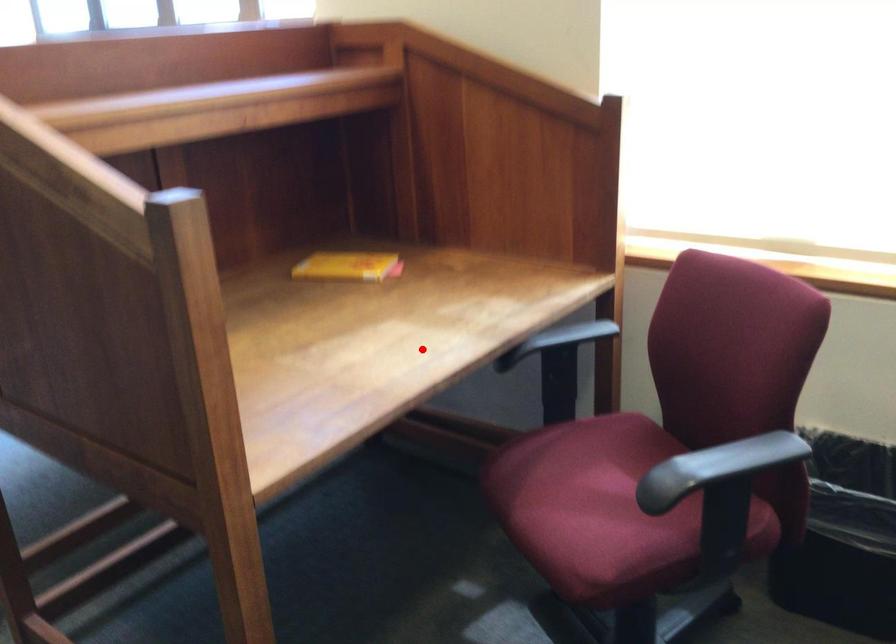
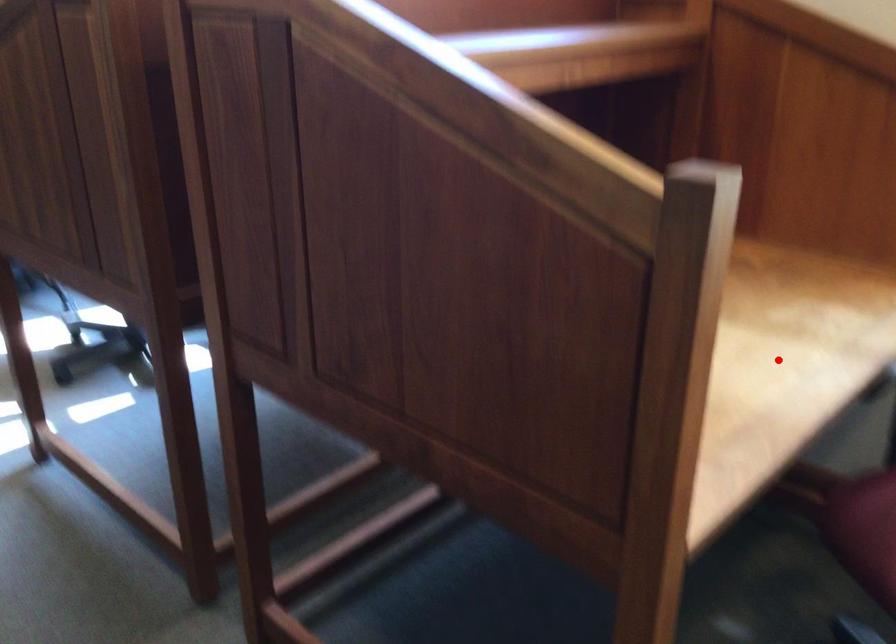
I am providing you with two images of the same scene from different viewpoints. A red point is marked on the first image and another point is marked on the second image. Is the red point in image1 aligned with the point shown in image2?

Yes